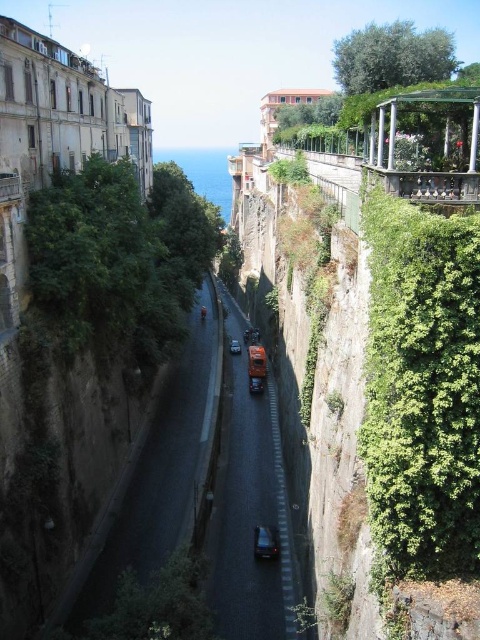
You are a delivery driver trying to navigate through the narrow road shown in the image. You see a shiny black car at center and a metallic silver car at center. Which car should you avoid overtaking to ensure you stay within the road limits?

You should avoid overtaking the shiny black car at center because its width is larger than the metallic silver car at center, making it harder to pass safely on the narrow road.

Consider the image. You are a tour guide explaining the vehicles on the narrow road. Which car, the shiny black car at center or the metallic silver car at center, is shorter in height?

The shiny black car at center is not as tall as the metallic silver car at center, so the shiny black car at center is shorter.

You are driving a car and want to park on the side of the road. Given the image, can you determine if there is enough space between the shiny metallic car at center and the green leafy ivy at right to safely park your vehicle?

The green leafy ivy at right is to the right of the shiny metallic car at center, so there is space between them. However, the road is narrow and winding, so you should check the available space carefully before attempting to park.